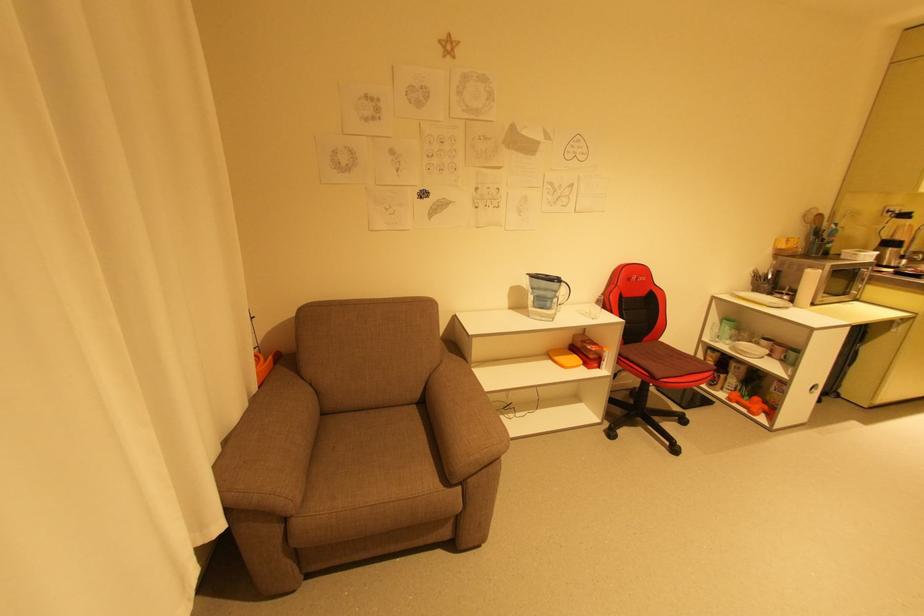
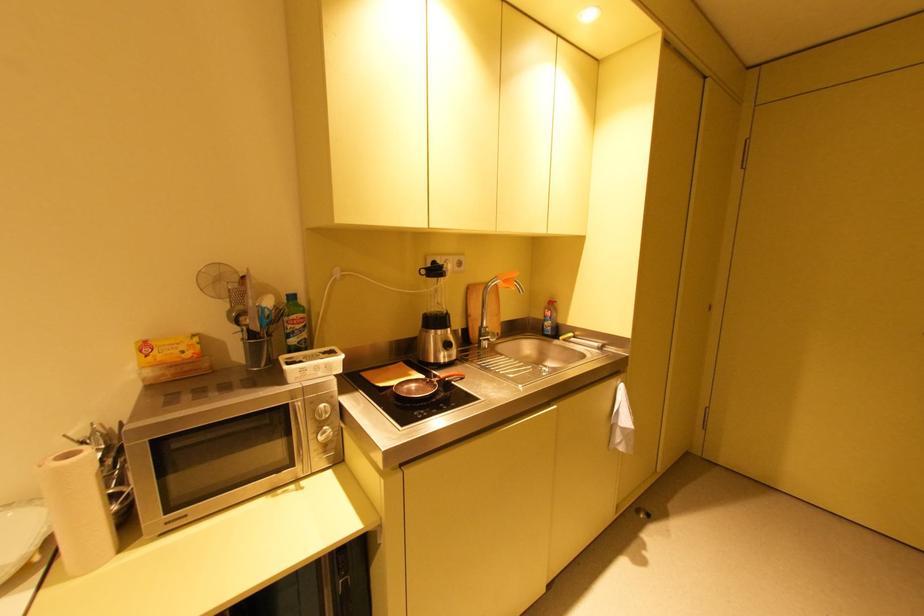
Locate, in the second image, the point that corresponds to the point at 793,241 in the first image.

(150, 347)